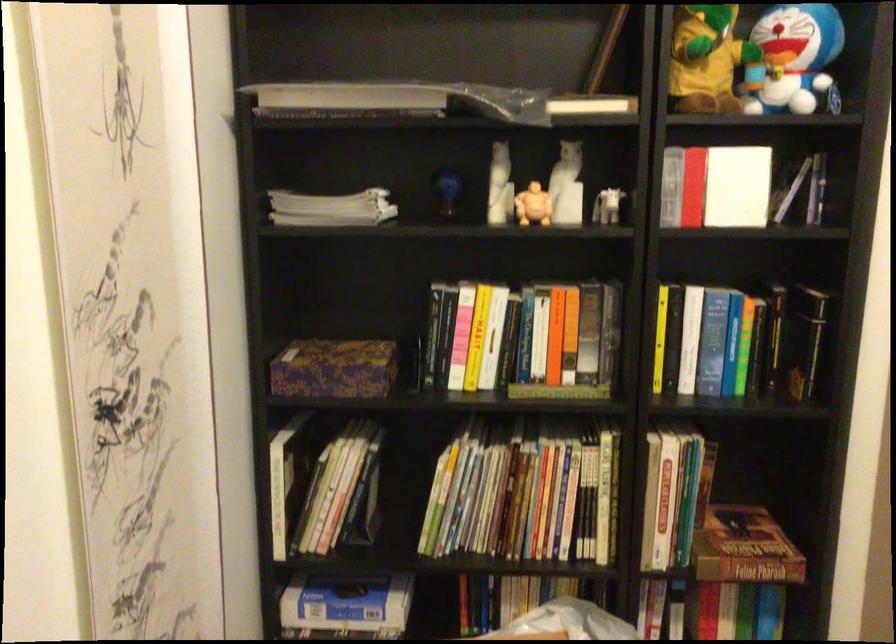
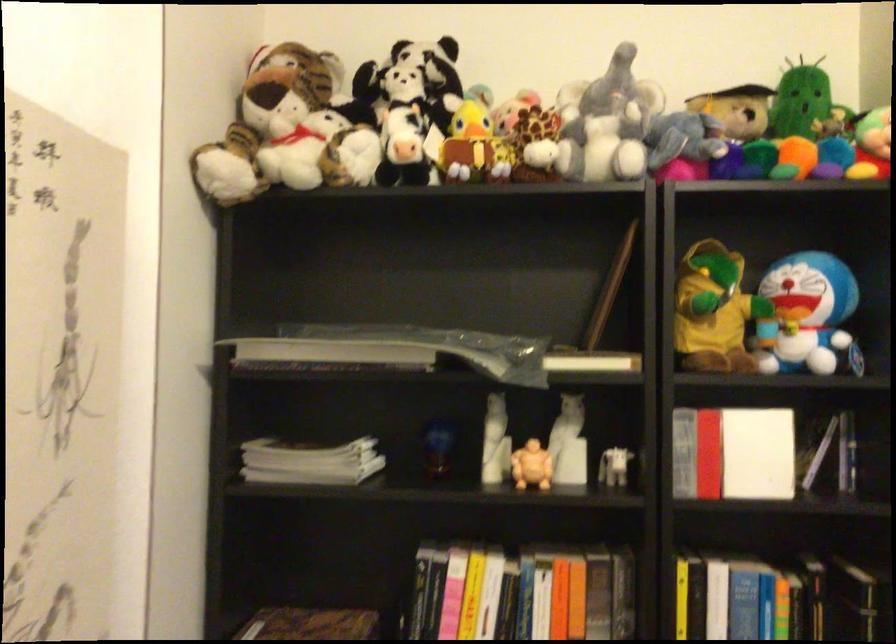
In the second image, find the point that corresponds to (501,184) in the first image.

(495, 442)